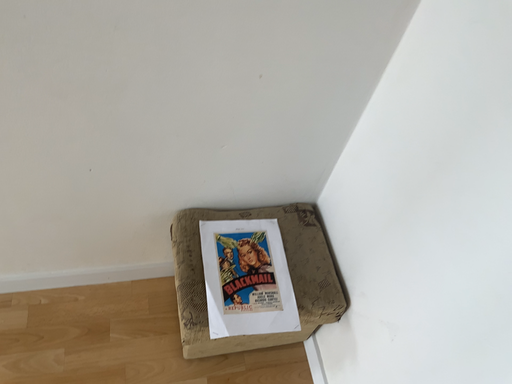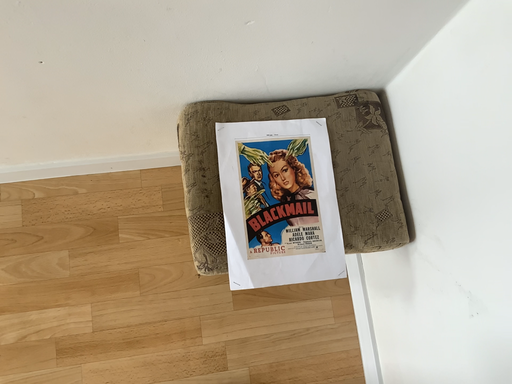
Question: Which way did the camera rotate in the video?

Choices:
 (A) rotated downward
 (B) rotated upward

Answer: (A)